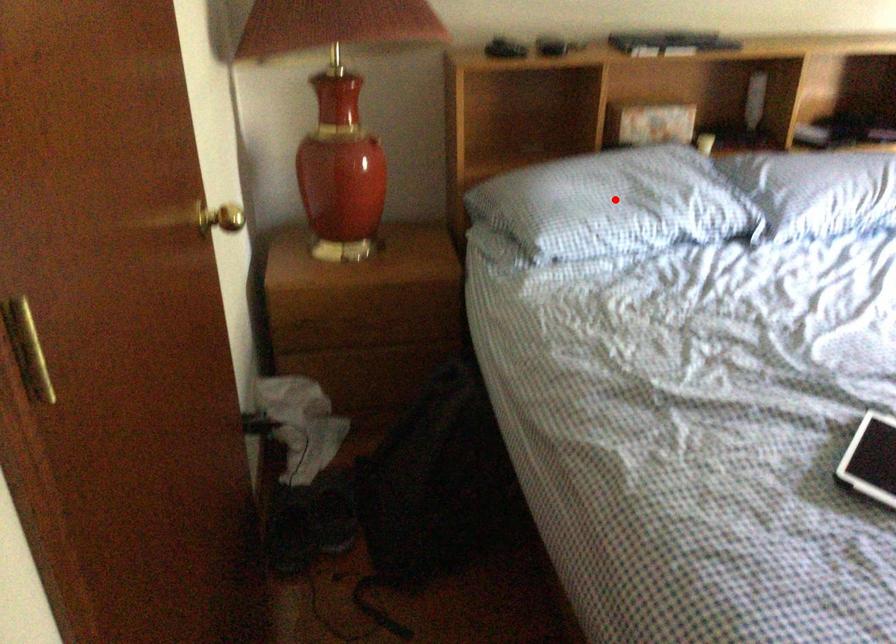
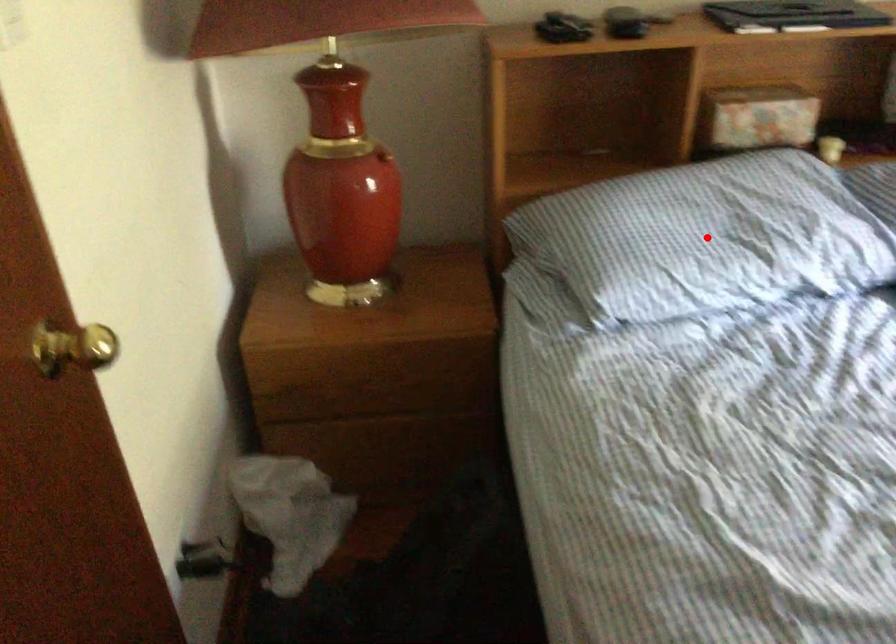
I am providing you with two images of the same scene from different viewpoints. A red point is marked on the first image and another point is marked on the second image. Are the points marked in image1 and image2 representing the same 3D position?

Yes